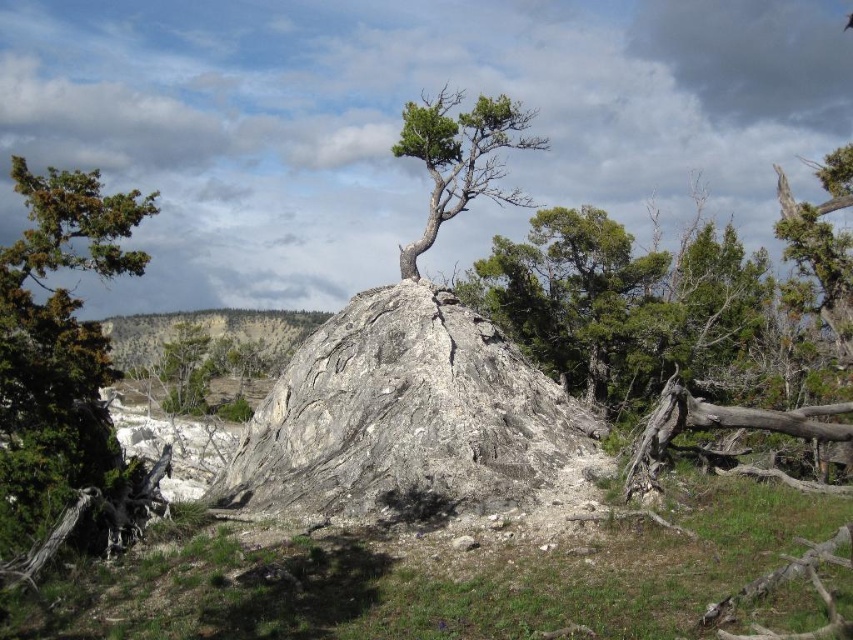
Who is higher up, green rough bark tree at left or green textured tree at center?

green textured tree at center is above.

Does point (61, 189) come in front of point (451, 176)?

That is True.

The width and height of the screenshot is (853, 640). Identify the location of green rough bark tree at left. (64, 378).

You are a GUI agent. You are given a task and a screenshot of the screen. Output one action in this format:
    pyautogui.click(x=<x>, y=<y>)
    Task: Click on the green rough bark tree at left
    
    Given the screenshot: What is the action you would take?
    pyautogui.click(x=64, y=378)

Is gray rough rock at center bigger than green rough bark tree at left?

No, gray rough rock at center is not bigger than green rough bark tree at left.

Can you confirm if gray rough rock at center is thinner than green rough bark tree at left?

Correct, gray rough rock at center's width is less than green rough bark tree at left's.

Is point (346, 346) positioned in front of point (68, 193)?

No, it is behind (68, 193).

In order to click on gray rough rock at center in this screenshot , I will do `click(410, 420)`.

Is gray rough rock at center to the right of green textured tree at center from the viewer's perspective?

Correct, you'll find gray rough rock at center to the right of green textured tree at center.

Between point (589, 448) and point (479, 122), which one is positioned behind?

The point (479, 122) is behind.

Identify the location of gray rough rock at center. The height and width of the screenshot is (640, 853). (410, 420).